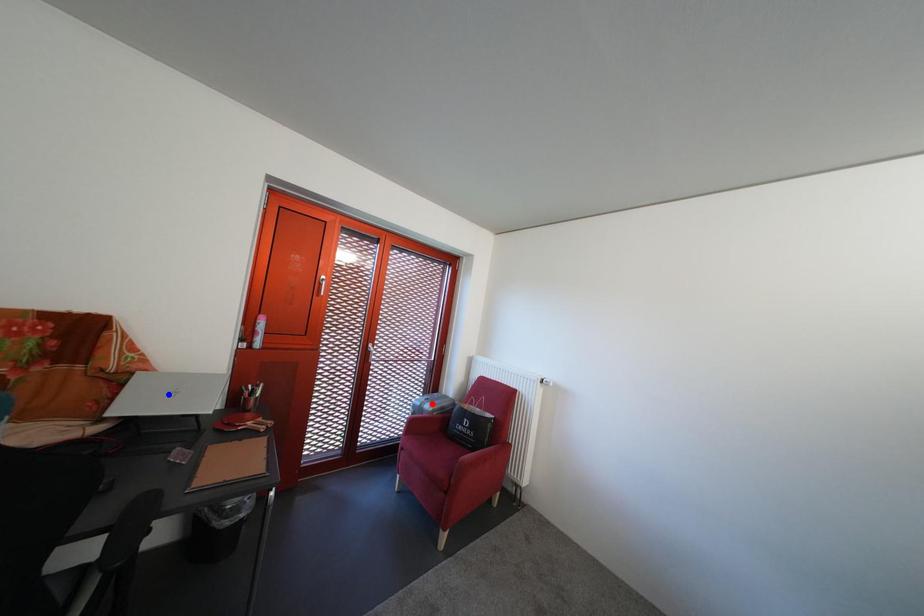
Question: Two points are marked on the image. Which point is closer to the camera?

Choices:
 (A) Blue point is closer.
 (B) Red point is closer.

Answer: (A)